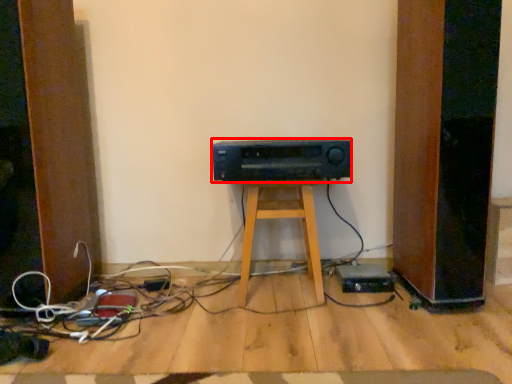
Question: From the image's perspective, where is amplifier (annotated by the red box) located relative to furniture?

Choices:
 (A) below
 (B) above

Answer: (B)